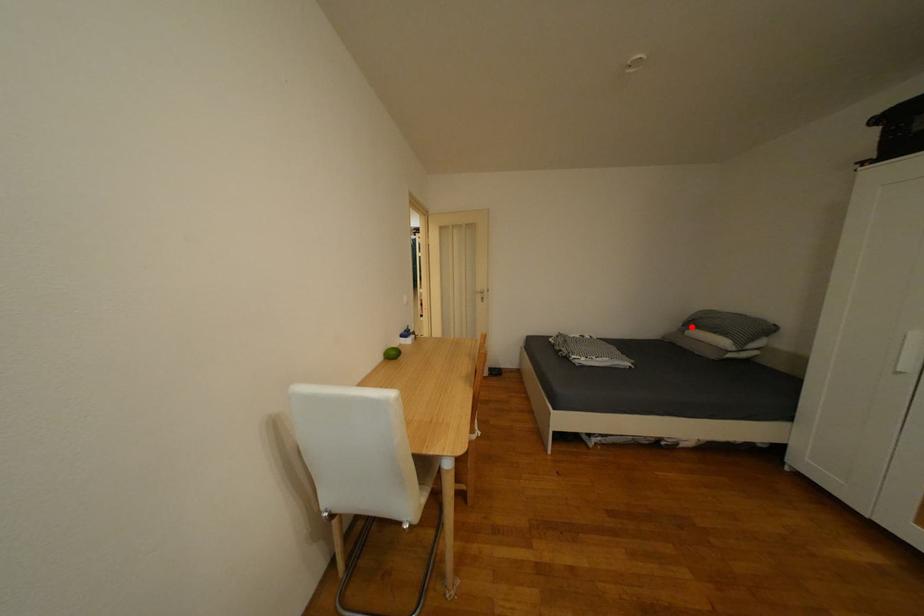
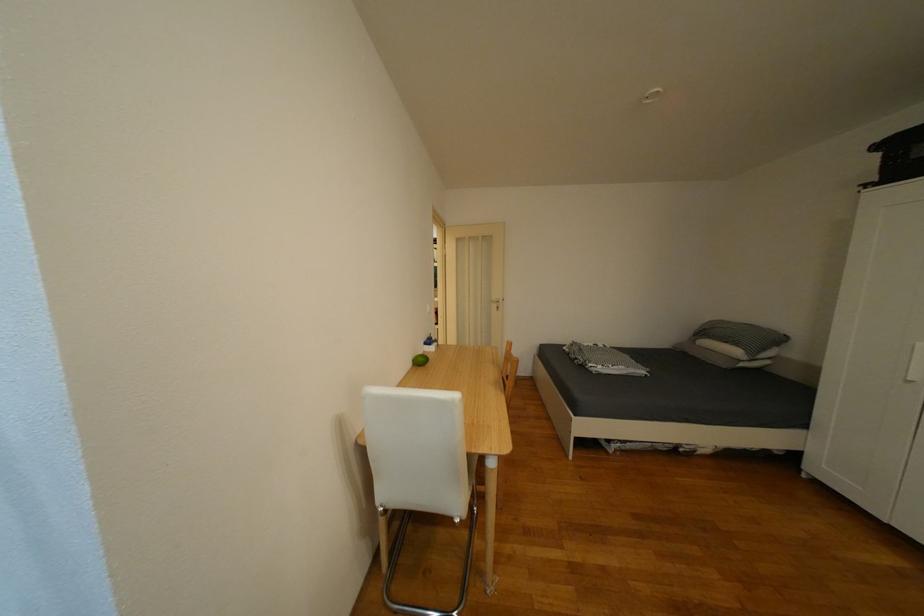
In the second image, find the point that corresponds to the highlighted location in the first image.

(702, 337)